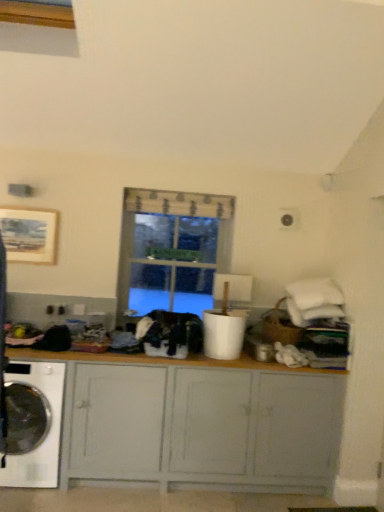
Question: Does clear glass window at center come in front of black fabric at center?

Choices:
 (A) yes
 (B) no

Answer: (B)

Question: From the image's perspective, is clear glass window at center on top of black fabric at center?

Choices:
 (A) yes
 (B) no

Answer: (A)

Question: From the image's perspective, does clear glass window at center appear lower than black fabric at center?

Choices:
 (A) no
 (B) yes

Answer: (A)

Question: Can you confirm if clear glass window at center is bigger than black fabric at center?

Choices:
 (A) yes
 (B) no

Answer: (A)

Question: Is clear glass window at center at the right side of black fabric at center?

Choices:
 (A) yes
 (B) no

Answer: (A)

Question: From their relative heights in the image, would you say black fabric at center is taller or shorter than white glossy washing machine at lower left?

Choices:
 (A) short
 (B) tall

Answer: (A)

Question: From a real-world perspective, relative to white glossy washing machine at lower left, is black fabric at center vertically above or below?

Choices:
 (A) below
 (B) above

Answer: (B)

Question: Looking at their shapes, would you say black fabric at center is wider or thinner than white glossy washing machine at lower left?

Choices:
 (A) wide
 (B) thin

Answer: (B)

Question: Is black fabric at center inside the boundaries of white glossy washing machine at lower left, or outside?

Choices:
 (A) outside
 (B) inside

Answer: (A)

Question: Looking at the image, does clear glass window at center seem bigger or smaller compared to black fabric at center?

Choices:
 (A) big
 (B) small

Answer: (A)

Question: Which is correct: clear glass window at center is inside black fabric at center, or outside of it?

Choices:
 (A) outside
 (B) inside

Answer: (A)

Question: Does point (192, 297) appear closer or farther from the camera than point (148, 317)?

Choices:
 (A) farther
 (B) closer

Answer: (A)

Question: In the image, is clear glass window at center positioned in front of or behind black fabric at center?

Choices:
 (A) front
 (B) behind

Answer: (B)

Question: From a real-world perspective, relative to black fabric at center, is matte gray cabinet at center vertically above or below?

Choices:
 (A) below
 (B) above

Answer: (A)

Question: Considering the positions of matte gray cabinet at center and black fabric at center in the image, is matte gray cabinet at center wider or thinner than black fabric at center?

Choices:
 (A) thin
 (B) wide

Answer: (B)